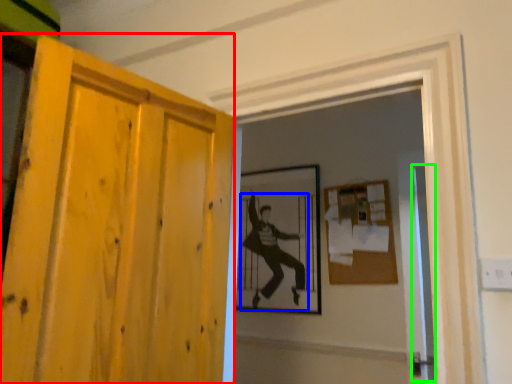
Question: Which object is the farthest from door (highlighted by a red box)? Choose among these: person (highlighted by a blue box) or screen door (highlighted by a green box).

Choices:
 (A) person
 (B) screen door

Answer: (A)